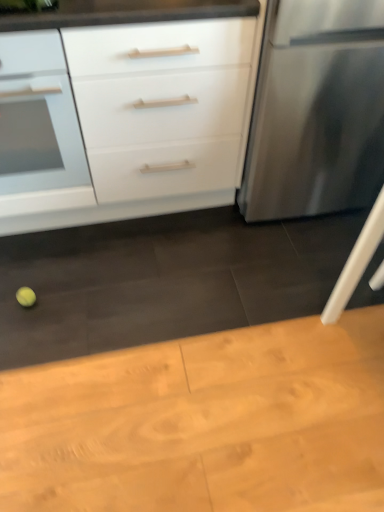
What do you see at coordinates (204, 423) in the screenshot?
I see `wooden table at lower center` at bounding box center [204, 423].

What do you see at coordinates (134, 114) in the screenshot? I see `white matte cabinet at center` at bounding box center [134, 114].

Image resolution: width=384 pixels, height=512 pixels. Find the location of `yellow matte tennis ball at lower left`. yellow matte tennis ball at lower left is located at coordinates (26, 297).

From a real-world perspective, is white matte drawer at left, which ranks as the first drawer in back-to-front order, below white matte drawer at upper left, the 1th drawer in the front-to-back sequence?

Yes, from a real-world perspective, white matte drawer at left, which ranks as the first drawer in back-to-front order, is under white matte drawer at upper left, the 1th drawer in the front-to-back sequence.

How many degrees apart are the facing directions of white matte drawer at left, which ranks as the first drawer in back-to-front order, and white matte drawer at upper left, the 1th drawer in the front-to-back sequence?

The angular difference between white matte drawer at left, which ranks as the first drawer in back-to-front order, and white matte drawer at upper left, the 1th drawer in the front-to-back sequence, is 7.64e-06 degrees.

From the image's perspective, which object appears higher, white matte drawer at left, which is the second drawer from front to back, or white matte drawer at upper left, the 1th drawer in the front-to-back sequence?

white matte drawer at upper left, the 1th drawer in the front-to-back sequence, from the image's perspective.

Based on the photo, is white matte drawer at left, which is the second drawer from front to back, placed right next to white matte drawer at upper left, the 1th drawer in the front-to-back sequence?

No, white matte drawer at left, which is the second drawer from front to back, is not next to white matte drawer at upper left, the 1th drawer in the front-to-back sequence.

Looking at this image, measure the distance between yellow matte tennis ball at lower left and white matte drawer at left, which ranks as the first drawer in back-to-front order.

They are 58.95 centimeters apart.

Is yellow matte tennis ball at lower left touching white matte drawer at left, which ranks as the first drawer in back-to-front order?

No.

Considering the positions of objects yellow matte tennis ball at lower left and white matte drawer at left, which is the second drawer from front to back, in the image provided, who is in front, yellow matte tennis ball at lower left or white matte drawer at left, which is the second drawer from front to back,?

white matte drawer at left, which is the second drawer from front to back, is closer to the camera.

Is stainless steel refrigerator at right looking in the opposite direction of wooden table at lower center?

stainless steel refrigerator at right is not turned away from wooden table at lower center.

How different are the orientations of stainless steel refrigerator at right and wooden table at lower center in degrees?

stainless steel refrigerator at right and wooden table at lower center are facing 179 degrees away from each other.

Is stainless steel refrigerator at right in front of or behind wooden table at lower center in the image?

In the image, stainless steel refrigerator at right appears behind wooden table at lower center.

Considering the relative sizes of stainless steel refrigerator at right and wooden table at lower center in the image provided, is stainless steel refrigerator at right shorter than wooden table at lower center?

Incorrect, the height of stainless steel refrigerator at right does not fall short of that of wooden table at lower center.

Is stainless steel refrigerator at right not within yellow matte tennis ball at lower left?

Indeed, stainless steel refrigerator at right is completely outside yellow matte tennis ball at lower left.

Between stainless steel refrigerator at right and yellow matte tennis ball at lower left, which one has larger size?

stainless steel refrigerator at right.

Does stainless steel refrigerator at right have a greater width compared to yellow matte tennis ball at lower left?

Indeed, stainless steel refrigerator at right has a greater width compared to yellow matte tennis ball at lower left.

Considering the positions of objects stainless steel refrigerator at right and yellow matte tennis ball at lower left in the image provided, who is behind, stainless steel refrigerator at right or yellow matte tennis ball at lower left?

yellow matte tennis ball at lower left.

Is white matte drawer at left, which ranks as the first drawer in back-to-front order, oriented towards yellow matte tennis ball at lower left?

Yes, white matte drawer at left, which ranks as the first drawer in back-to-front order, is oriented towards yellow matte tennis ball at lower left.

Can you confirm if white matte drawer at left, which is the second drawer from front to back, is bigger than yellow matte tennis ball at lower left?

Yes, white matte drawer at left, which is the second drawer from front to back, is bigger than yellow matte tennis ball at lower left.

From the image's perspective, is white matte drawer at left, which is the second drawer from front to back, under yellow matte tennis ball at lower left?

Actually, white matte drawer at left, which is the second drawer from front to back, appears above yellow matte tennis ball at lower left in the image.

Starting from the white matte cabinet at center, which drawer is the 2nd one to the left? Please provide its 2D coordinates.

[(39, 128)]

Consider the image. Is white matte drawer at left, which ranks as the first drawer in back-to-front order, completely or partially inside white matte cabinet at center?

Yes, white matte cabinet at center is surrounding white matte drawer at left, which ranks as the first drawer in back-to-front order.

Which is more to the right, white matte cabinet at center or white matte drawer at left, which is the second drawer from front to back?

white matte cabinet at center.

Is white matte cabinet at center far from white matte drawer at left, which is the second drawer from front to back?

That's not correct — white matte cabinet at center is a little close to white matte drawer at left, which is the second drawer from front to back.

Considering the relative positions of white matte drawer at upper left, which is the 2th drawer in back-to-front order, and white matte cabinet at center in the image provided, is white matte drawer at upper left, which is the 2th drawer in back-to-front order, to the right of white matte cabinet at center from the viewer's perspective?

Incorrect, white matte drawer at upper left, which is the 2th drawer in back-to-front order, is not on the right side of white matte cabinet at center.

From a real-world perspective, which object rests below the other?

white matte cabinet at center is physically lower.

Is white matte drawer at upper left, the 1th drawer in the front-to-back sequence, further to the viewer compared to white matte cabinet at center?

That is True.

What are the coordinates of `drawer below the white matte drawer at upper left, which is the 2th drawer in back-to-front order (from the image's perspective)` in the screenshot? It's located at (39, 128).

Which drawer is the 1st one when counting from the front of the yellow matte tennis ball at lower left? Please provide its 2D coordinates.

[(39, 128)]

Looking at the image, which one is located closer to wooden table at lower center, yellow matte tennis ball at lower left or white matte drawer at left, which ranks as the first drawer in back-to-front order?

yellow matte tennis ball at lower left.

When comparing their distances from white matte drawer at upper left, the 1th drawer in the front-to-back sequence, does white matte cabinet at center or white matte drawer at left, which ranks as the first drawer in back-to-front order, seem further?

Based on the image, white matte cabinet at center appears to be further to white matte drawer at upper left, the 1th drawer in the front-to-back sequence.

Looking at the image, which one is located further to yellow matte tennis ball at lower left, white matte cabinet at center or wooden table at lower center?

Based on the image, wooden table at lower center appears to be further to yellow matte tennis ball at lower left.

Estimate the real-world distances between objects in this image. Which object is closer to yellow matte tennis ball at lower left, wooden table at lower center or white matte cabinet at center?

Among the two, white matte cabinet at center is located nearer to yellow matte tennis ball at lower left.

Which object lies nearer to the anchor point wooden table at lower center, white matte drawer at upper left, which is the 2th drawer in back-to-front order, or white matte cabinet at center?

white matte cabinet at center lies closer to wooden table at lower center than the other object.

Looking at this image, looking at the image, which one is located closer to yellow matte tennis ball at lower left, white matte cabinet at center or white matte drawer at left, which is the second drawer from front to back?

white matte drawer at left, which is the second drawer from front to back.

From the image, which object appears to be nearer to yellow matte tennis ball at lower left, white matte drawer at upper left, which is the 2th drawer in back-to-front order, or wooden table at lower center?

Based on the image, wooden table at lower center appears to be nearer to yellow matte tennis ball at lower left.

From the picture: Looking at the image, which one is located closer to wooden table at lower center, white matte drawer at upper left, the 1th drawer in the front-to-back sequence, or yellow matte tennis ball at lower left?

yellow matte tennis ball at lower left.

You are a GUI agent. You are given a task and a screenshot of the screen. Output one action in this format:
    pyautogui.click(x=<x>, y=<y>)
    Task: Click on the chest of drawers between stainless steel refrigerator at right and wooden table at lower center in the up-down direction
    Image resolution: width=384 pixels, height=512 pixels.
    Given the screenshot: What is the action you would take?
    pyautogui.click(x=134, y=114)

In order to click on drawer between yellow matte tennis ball at lower left and stainless steel refrigerator at right in this screenshot , I will do (x=30, y=52).

Locate an element on the screen. Image resolution: width=384 pixels, height=512 pixels. lime situated between white matte drawer at left, which is the second drawer from front to back, and wooden table at lower center from left to right is located at coordinates (26, 297).

You are a GUI agent. You are given a task and a screenshot of the screen. Output one action in this format:
    pyautogui.click(x=<x>, y=<y>)
    Task: Click on the chest of drawers between white matte drawer at upper left, which is the 2th drawer in back-to-front order, and white matte drawer at left, which is the second drawer from front to back, vertically
    Image resolution: width=384 pixels, height=512 pixels.
    Given the screenshot: What is the action you would take?
    pyautogui.click(x=134, y=114)